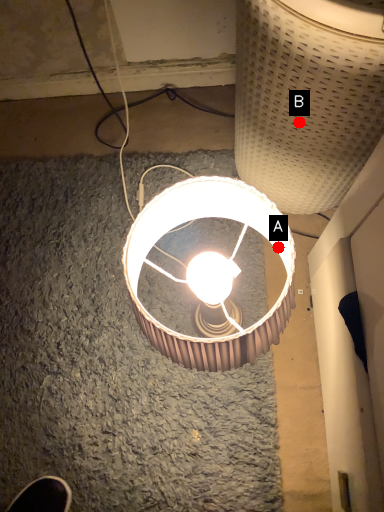
Question: Two points are circled on the image, labeled by A and B beside each circle. Which point is closer to the camera?

Choices:
 (A) A is closer
 (B) B is closer

Answer: (A)